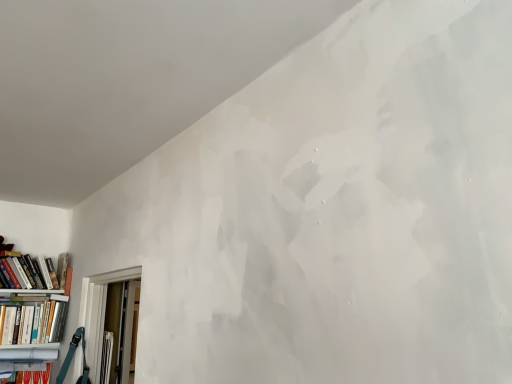
Question: In terms of width, does hardcover book at left, the 2th book ordered from the bottom, look wider or thinner when compared to matte white bookcase at lower left?

Choices:
 (A) thin
 (B) wide

Answer: (A)

Question: Is point (37, 263) positioned closer to the camera than point (30, 292)?

Choices:
 (A) closer
 (B) farther

Answer: (B)

Question: Estimate the real-world distances between objects in this image. Which object is closer to the hardcover book at left, arranged as the first book when ordered from the bottom?

Choices:
 (A) matte white bookcase at lower left
 (B) hardcover book at left, the 1th book positioned from the top

Answer: (A)

Question: Considering the real-world distances, which object is closest to the hardcover book at left, placed as the 2th book when sorted from top to bottom?

Choices:
 (A) hardcover book at left, the 1th book positioned from the top
 (B) matte white bookcase at lower left

Answer: (B)